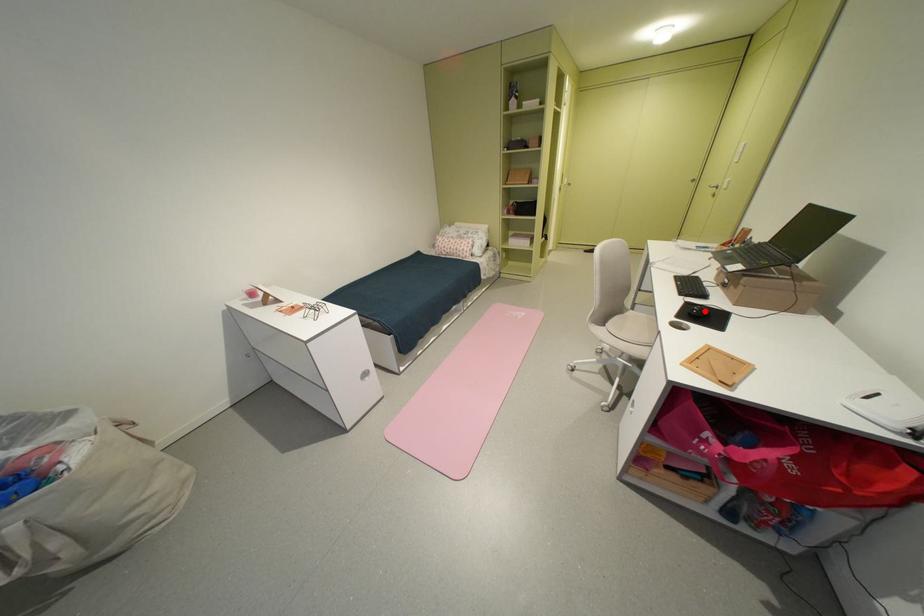
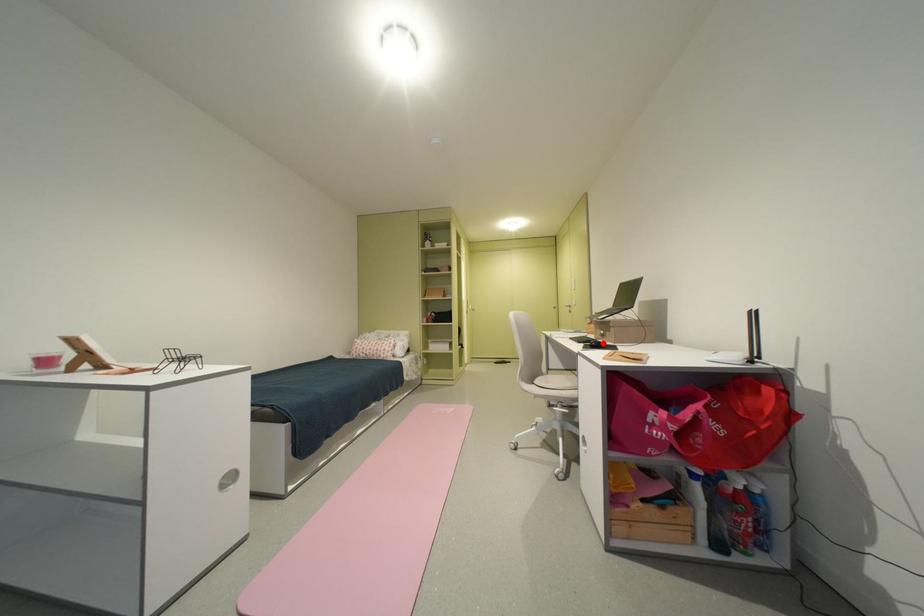
I am providing you with two images of the same scene from different viewpoints. A red point is marked on the first image and another point is marked on the second image. Are the points marked in image1 and image2 representing the same 3D position?

Yes